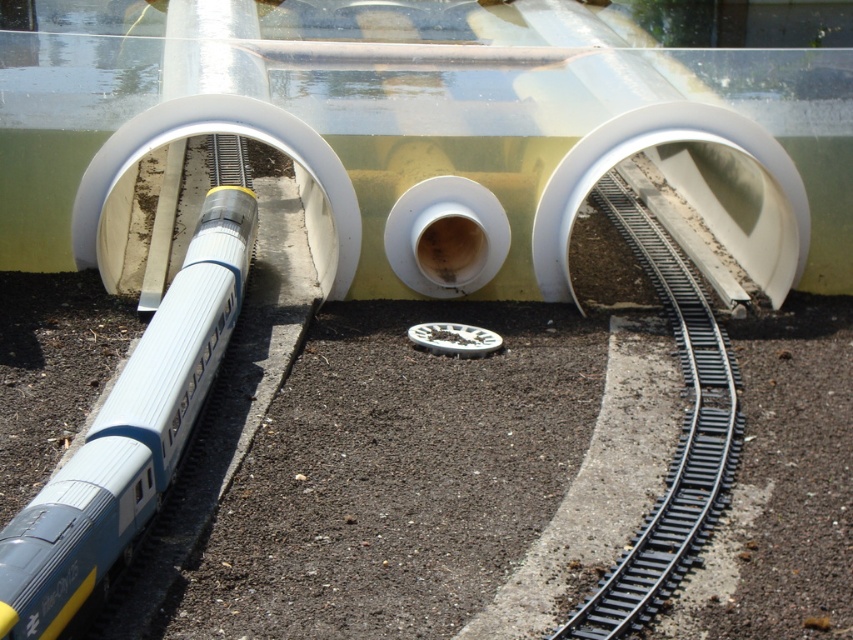
Question: Does silver metallic train at center have a smaller size compared to black metal train track at center right?

Choices:
 (A) no
 (B) yes

Answer: (A)

Question: Does silver metallic train at center have a lesser width compared to black metal train track at center right?

Choices:
 (A) yes
 (B) no

Answer: (A)

Question: Which point is closer to the camera taking this photo?

Choices:
 (A) (654, 515)
 (B) (200, 332)

Answer: (A)

Question: Which of the following is the closest to the observer?

Choices:
 (A) [242, 276]
 (B) [712, 452]

Answer: (B)

Question: Can you confirm if silver metallic train at center is bigger than black metal train track at center right?

Choices:
 (A) yes
 (B) no

Answer: (A)

Question: Which point is farther from the camera taking this photo?

Choices:
 (A) (706, 468)
 (B) (85, 502)

Answer: (A)